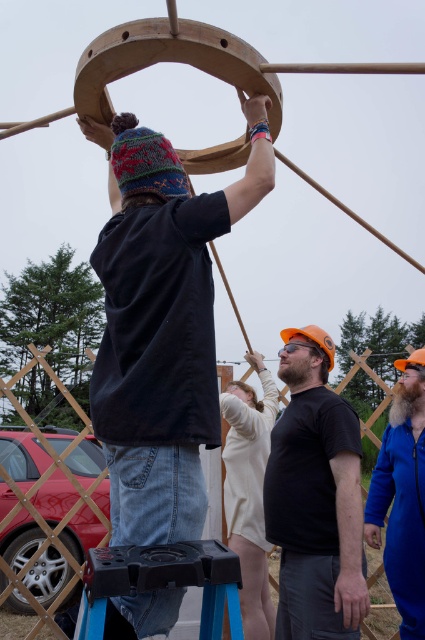
Question: Does knitted wool beanie at upper left appear on the right side of black plastic stool at lower center?

Choices:
 (A) no
 (B) yes

Answer: (A)

Question: Is knitted wool beanie at upper left to the left of black plastic stool at lower center from the viewer's perspective?

Choices:
 (A) no
 (B) yes

Answer: (B)

Question: Does knitted wool beanie at upper left appear under black matte helmet at center?

Choices:
 (A) yes
 (B) no

Answer: (B)

Question: Which of the following is the farthest from the observer?

Choices:
 (A) (175, 449)
 (B) (113, 579)

Answer: (A)

Question: Which object is the farthest from the blue fuzzy beanie at upper left?

Choices:
 (A) black matte helmet at center
 (B) black plastic stool at lower center

Answer: (B)

Question: Estimate the real-world distances between objects in this image. Which object is closer to the black plastic stool at lower center?

Choices:
 (A) black matte helmet at center
 (B) knitted wool beanie at upper left

Answer: (B)